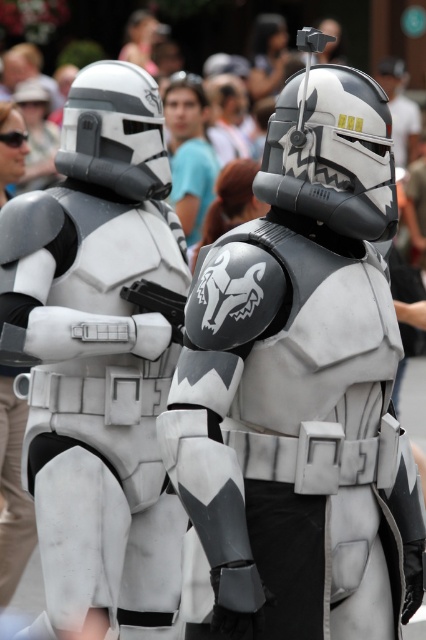
You are a photographer at a Star Wars themed event. You need to capture a photo of the matte white armor at center and the blue cotton shirt at center. Which object is wider?

The matte white armor at center is wider than the blue cotton shirt at center according to the description.